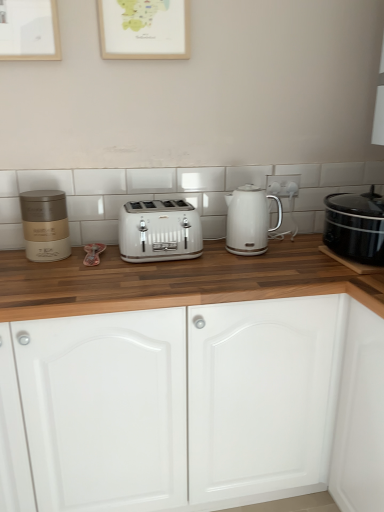
Image resolution: width=384 pixels, height=512 pixels. I want to click on unoccupied region to the right of white metallic toaster at center, so (224, 260).